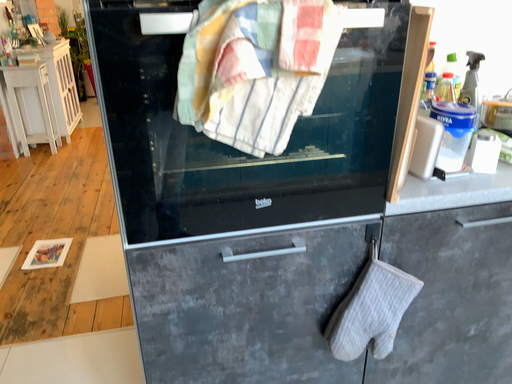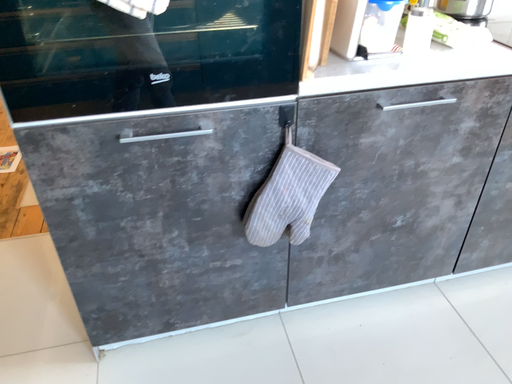
Question: How did the camera likely rotate when shooting the video?

Choices:
 (A) rotated downward
 (B) rotated upward

Answer: (A)